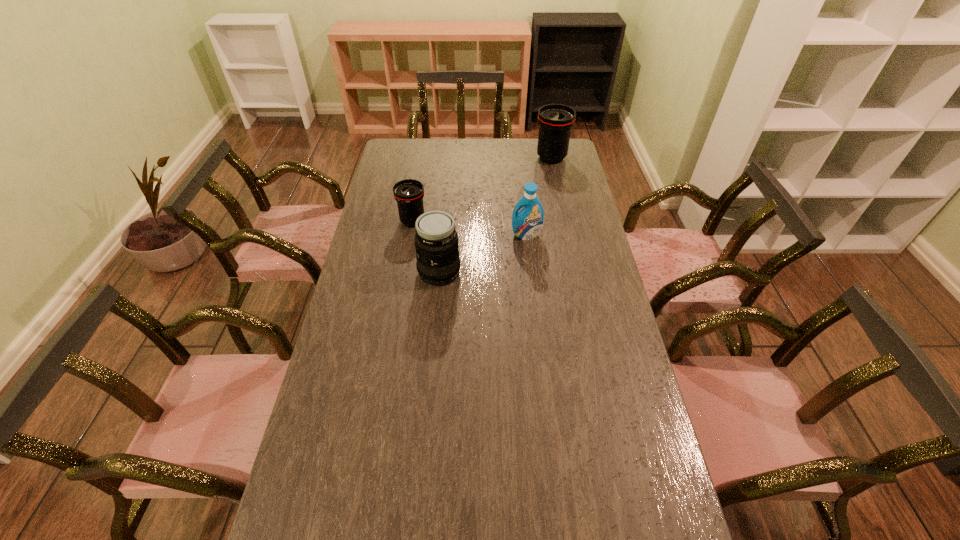
Identify the location of unoccupied area between the nearest telephoto lens and the farthest object. Image resolution: width=960 pixels, height=540 pixels. (495, 215).

Locate an element on the screen. The width and height of the screenshot is (960, 540). free space between the third object from left to right and the nearest object is located at coordinates (483, 254).

At what (x,y) coordinates should I click in order to perform the action: click on empty location between the second farthest telephoto lens and the rightmost object. Please return your answer as a coordinate pair (x, y). The image size is (960, 540). Looking at the image, I should click on (482, 190).

You are a GUI agent. You are given a task and a screenshot of the screen. Output one action in this format:
    pyautogui.click(x=<x>, y=<y>)
    Task: Click on the object that ranks as the closest to the third object from left to right
    
    Given the screenshot: What is the action you would take?
    pyautogui.click(x=436, y=241)

Identify which object is located as the second nearest to the detergent. Please provide its 2D coordinates. Your answer should be formatted as a tuple, i.e. [(x, y)], where the tuple contains the x and y coordinates of a point satisfying the conditions above.

[(409, 193)]

Locate an element on the screen. This screenshot has width=960, height=540. telephoto lens identified as the closest to the detergent is located at coordinates (436, 241).

Identify which telephoto lens is the closest to the nearest telephoto lens. Please provide its 2D coordinates. Your answer should be formatted as a tuple, i.e. [(x, y)], where the tuple contains the x and y coordinates of a point satisfying the conditions above.

[(409, 193)]

Identify the location of vacant space that satisfies the following two spatial constraints: 1. on the front side of the nearest telephoto lens; 2. on the right side of the shortest object. Image resolution: width=960 pixels, height=540 pixels. (404, 272).